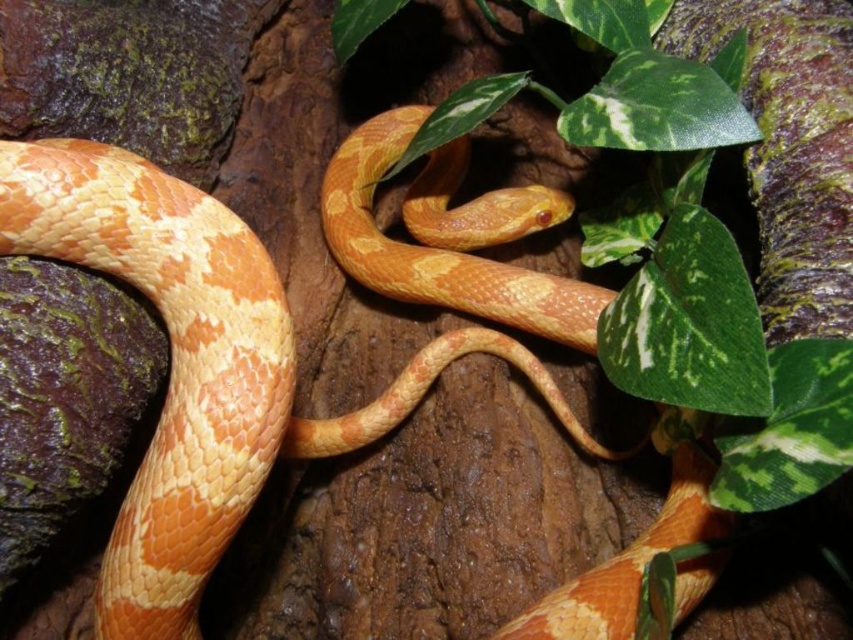
Is point (531, 285) in front of point (558, 317)?

No, it is behind (558, 317).

Does orange scaly snake at center appear on the right side of green leafy plant at upper center?

Incorrect, orange scaly snake at center is not on the right side of green leafy plant at upper center.

Is point (242, 358) less distant than point (375, 122)?

Yes, point (242, 358) is closer to viewer.

This screenshot has height=640, width=853. I want to click on orange scaly snake at center, so click(200, 365).